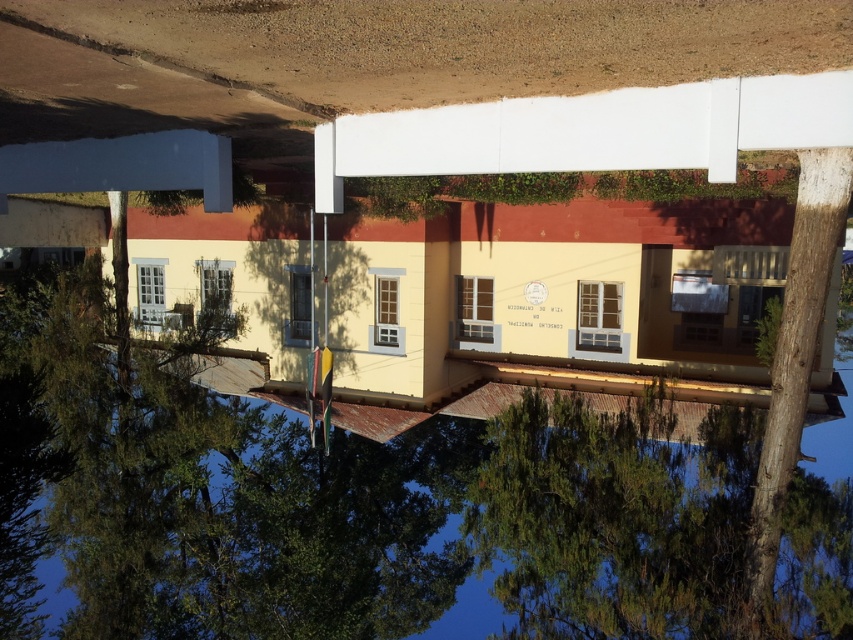
Question: Which of the following is the closest to the observer?

Choices:
 (A) transparent plastic water at center
 (B) smooth brown tree trunk at right

Answer: (A)

Question: Which of the following is the farthest from the observer?

Choices:
 (A) (525, 536)
 (B) (844, 164)

Answer: (A)

Question: Can you confirm if transparent plastic water at center is positioned above smooth brown tree trunk at right?

Choices:
 (A) yes
 (B) no

Answer: (B)

Question: Where is transparent plastic water at center located in relation to smooth brown tree trunk at right in the image?

Choices:
 (A) right
 (B) left

Answer: (B)

Question: In this image, where is transparent plastic water at center located relative to smooth brown tree trunk at right?

Choices:
 (A) right
 (B) left

Answer: (B)